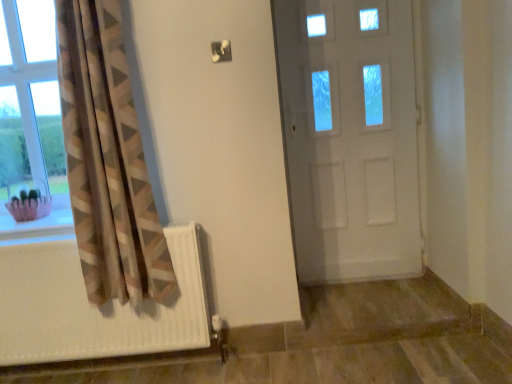
Question: Does point (62, 345) appear closer or farther from the camera than point (67, 223)?

Choices:
 (A) closer
 (B) farther

Answer: (A)

Question: Looking at their shapes, would you say white matte radiator at lower left is wider or thinner than pink fabric basket at lower left?

Choices:
 (A) wide
 (B) thin

Answer: (B)

Question: Considering the real-world distances, which object is closest to the white matte radiator at lower left?

Choices:
 (A) neutral fabric curtain at left
 (B) white glossy door at center
 (C) pink fabric basket at lower left
 (D) clear glass window at left

Answer: (A)

Question: Which object is the closest to the pink fabric basket at lower left?

Choices:
 (A) white glossy door at center
 (B) neutral fabric curtain at left
 (C) clear glass window at left
 (D) white matte radiator at lower left

Answer: (C)